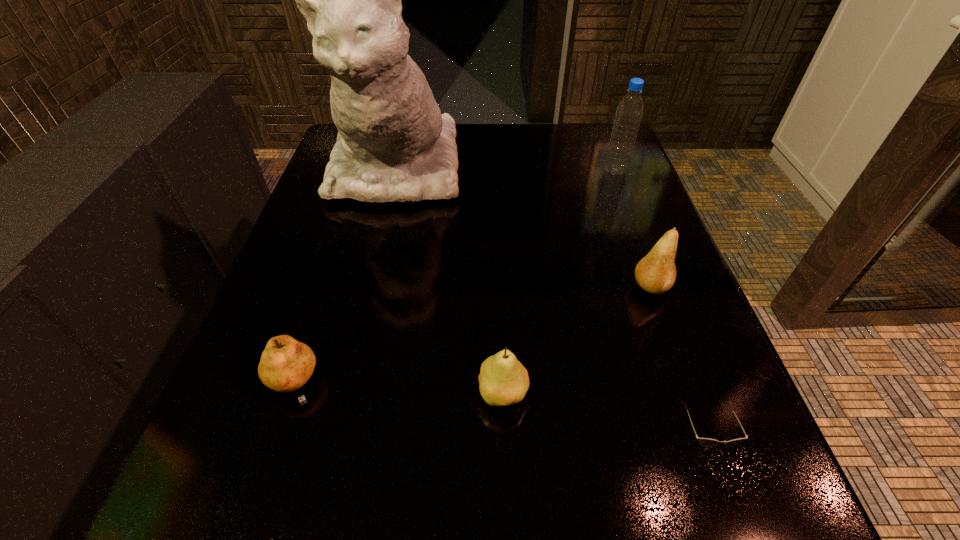
Identify which object is located as the nearest to the third object from left to right. Please provide its 2D coordinates. Your answer should be formatted as a tuple, i.e. [(x, y)], where the tuple contains the x and y coordinates of a point satisfying the conditions above.

[(706, 442)]

Find the location of a particular element. Image resolution: width=960 pixels, height=540 pixels. pear that is the closest to the water bottle is located at coordinates (655, 273).

The image size is (960, 540). I want to click on pear that is the closest to the second pear from left to right, so click(286, 365).

This screenshot has height=540, width=960. I want to click on free spot that satisfies the following two spatial constraints: 1. on the front side of the shortest pear; 2. on the left side of the third object from left to right, so click(291, 395).

Identify the location of free spot that satisfies the following two spatial constraints: 1. on the front-facing side of the water bottle; 2. on the left side of the tallest object. (396, 171).

Image resolution: width=960 pixels, height=540 pixels. In order to click on free location that satisfies the following two spatial constraints: 1. on the front-facing side of the tallest object; 2. on the right side of the third farthest object in this screenshot , I will do `click(368, 287)`.

Find the location of a particular element. free space that satisfies the following two spatial constraints: 1. on the front-facing side of the farthest pear; 2. on the right side of the tallest object is located at coordinates (368, 287).